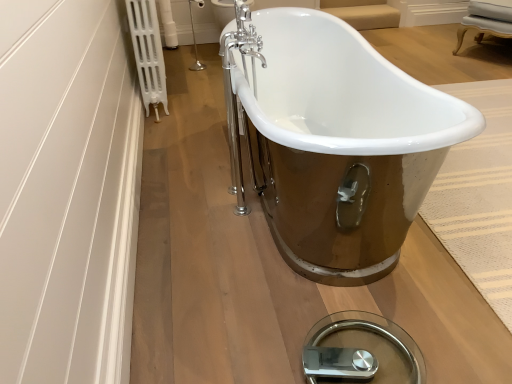
I want to click on vacant space to the right of white plastic radiator at upper left, so coord(199,91).